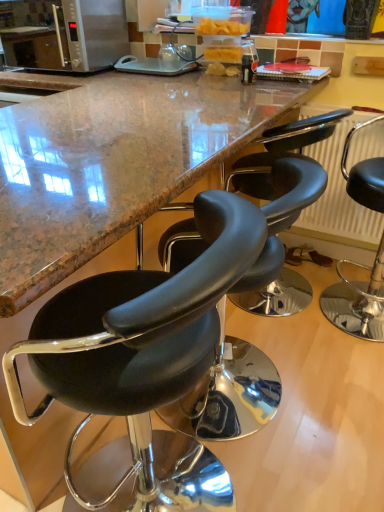
Question: Should I look upward or downward to see black leather stool at center, which is the first chair from left to right?

Choices:
 (A) down
 (B) up

Answer: (A)

Question: Considering the relative sizes of black leather stool at center, the second chair from the left, and black leather stool at center, marked as the 3th chair in a right-to-left arrangement, in the image provided, is black leather stool at center, the second chair from the left, wider than black leather stool at center, marked as the 3th chair in a right-to-left arrangement,?

Choices:
 (A) no
 (B) yes

Answer: (B)

Question: Considering the relative sizes of black leather stool at center, marked as the 2th chair in a right-to-left arrangement, and black leather stool at center, which is the first chair from left to right, in the image provided, is black leather stool at center, marked as the 2th chair in a right-to-left arrangement, smaller than black leather stool at center, which is the first chair from left to right,?

Choices:
 (A) yes
 (B) no

Answer: (A)

Question: From a real-world perspective, is black leather stool at center, the second chair from the left, located beneath black leather stool at center, which is the first chair from left to right?

Choices:
 (A) yes
 (B) no

Answer: (A)

Question: Is the depth of black leather stool at center, marked as the 2th chair in a right-to-left arrangement, less than that of black leather stool at center, which is the first chair from left to right?

Choices:
 (A) yes
 (B) no

Answer: (B)

Question: Considering the relative sizes of black leather stool at center, marked as the 2th chair in a right-to-left arrangement, and black leather stool at center, marked as the 3th chair in a right-to-left arrangement, in the image provided, is black leather stool at center, marked as the 2th chair in a right-to-left arrangement, bigger than black leather stool at center, marked as the 3th chair in a right-to-left arrangement,?

Choices:
 (A) yes
 (B) no

Answer: (B)

Question: Is black leather stool at center, the second chair from the left, to the left of black leather stool at center, which is the first chair from left to right, from the viewer's perspective?

Choices:
 (A) yes
 (B) no

Answer: (B)

Question: Is black leather stool at center, marked as the 3th chair in a right-to-left arrangement, to the right of satin silver microwave at upper left from the viewer's perspective?

Choices:
 (A) yes
 (B) no

Answer: (A)

Question: Does black leather stool at center, marked as the 3th chair in a right-to-left arrangement, have a smaller size compared to satin silver microwave at upper left?

Choices:
 (A) no
 (B) yes

Answer: (A)

Question: Are black leather stool at center, which is the first chair from left to right, and satin silver microwave at upper left beside each other?

Choices:
 (A) yes
 (B) no

Answer: (B)

Question: Is black leather stool at center, which is the first chair from left to right, oriented towards satin silver microwave at upper left?

Choices:
 (A) no
 (B) yes

Answer: (A)

Question: Considering the relative sizes of black leather stool at center, marked as the 3th chair in a right-to-left arrangement, and satin silver microwave at upper left in the image provided, is black leather stool at center, marked as the 3th chair in a right-to-left arrangement, wider than satin silver microwave at upper left?

Choices:
 (A) yes
 (B) no

Answer: (A)

Question: From the image's perspective, does black leather stool at center, which is the first chair from left to right, appear lower than satin silver microwave at upper left?

Choices:
 (A) yes
 (B) no

Answer: (A)

Question: Can you confirm if black leather stool at right, which is counted as the 3th chair, starting from the left, is taller than black leather stool at center, which is the first chair from left to right?

Choices:
 (A) yes
 (B) no

Answer: (B)